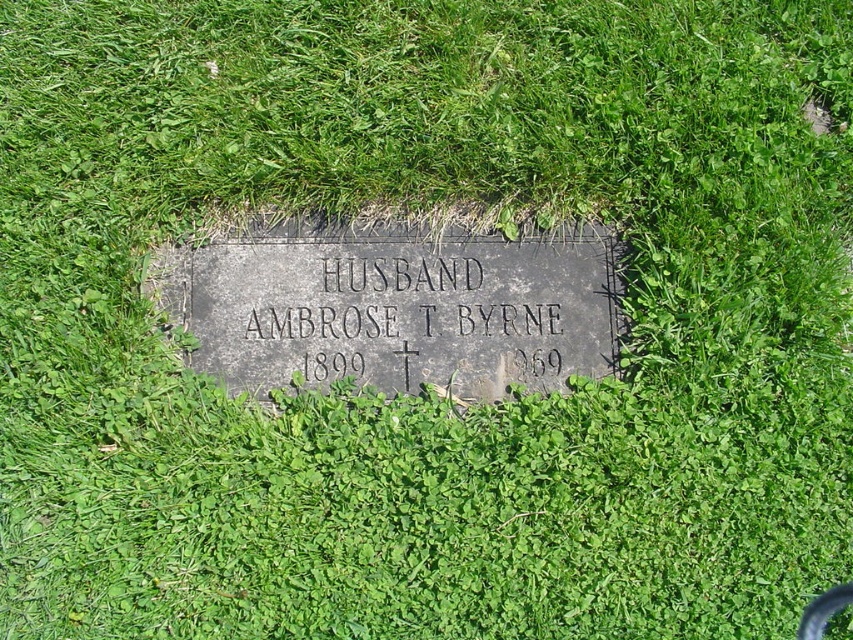
Question: Is dark gray stone plaque at center above black stone plaque at center?

Choices:
 (A) no
 (B) yes

Answer: (B)

Question: Which object appears closest to the camera in this image?

Choices:
 (A) black stone plaque at center
 (B) dark gray stone plaque at center

Answer: (B)

Question: Which point is farther to the camera?

Choices:
 (A) dark gray stone plaque at center
 (B) black stone plaque at center

Answer: (B)

Question: Can you confirm if dark gray stone plaque at center is smaller than black stone plaque at center?

Choices:
 (A) yes
 (B) no

Answer: (B)

Question: Among these points, which one is nearest to the camera?

Choices:
 (A) (410, 276)
 (B) (490, 282)

Answer: (A)

Question: Does dark gray stone plaque at center come behind black stone plaque at center?

Choices:
 (A) yes
 (B) no

Answer: (B)